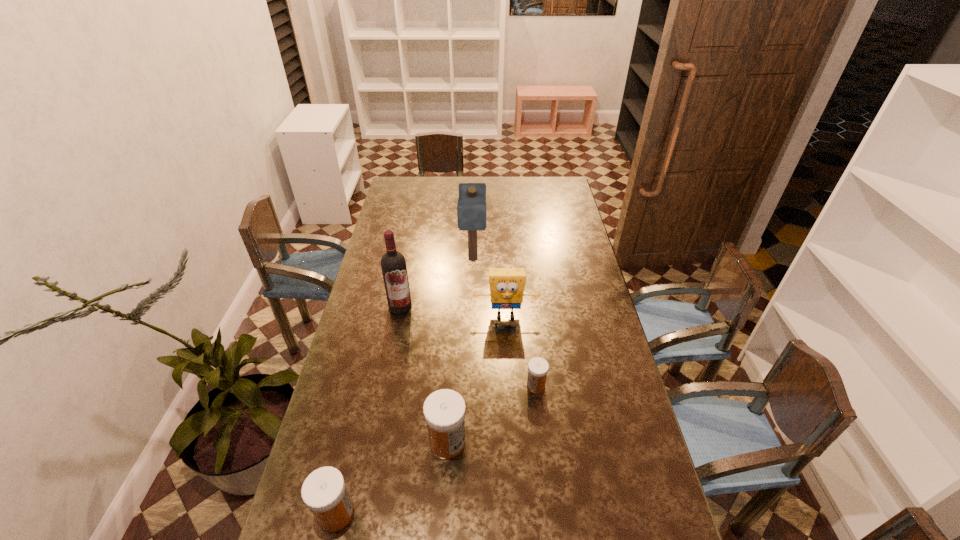
In the image, there is a desktop. At what (x,y) coordinates should I click in order to perform the action: click on free space at the near edge. Please return your answer as a coordinate pair (x, y). Looking at the image, I should click on (481, 518).

Locate an element on the screen. This screenshot has height=540, width=960. free space at the left edge is located at coordinates (412, 209).

The image size is (960, 540). In the image, there is a desktop. Find the location of `vacant region at the right edge`. vacant region at the right edge is located at coordinates (588, 301).

Where is `vacant space at the far right corner of the desktop`? vacant space at the far right corner of the desktop is located at coordinates (543, 188).

Where is `free point between the leftmost medicine and the wine bottle`? The height and width of the screenshot is (540, 960). free point between the leftmost medicine and the wine bottle is located at coordinates (368, 410).

Where is `vacant area between the shortest object and the second nearest object`? vacant area between the shortest object and the second nearest object is located at coordinates (492, 414).

This screenshot has width=960, height=540. Find the location of `empty space that is in between the sponge and the leftmost medicine`. empty space that is in between the sponge and the leftmost medicine is located at coordinates (420, 415).

I want to click on free space between the mallet and the wine bottle, so click(437, 282).

The height and width of the screenshot is (540, 960). In order to click on unoccupied area between the shortest object and the wine bottle in this screenshot , I will do `click(468, 346)`.

You are a GUI agent. You are given a task and a screenshot of the screen. Output one action in this format:
    pyautogui.click(x=<x>, y=<y>)
    Task: Click on the unoccupied position between the shortest medicine and the farthest object
    This screenshot has height=540, width=960.
    Given the screenshot: What is the action you would take?
    pyautogui.click(x=504, y=322)